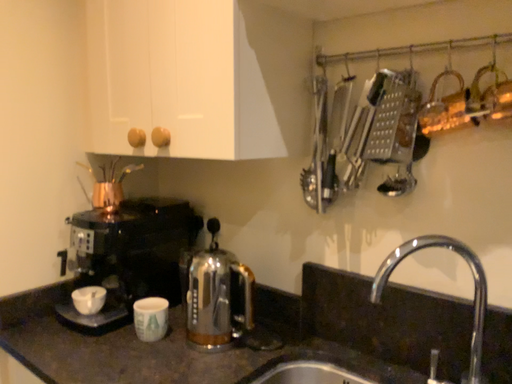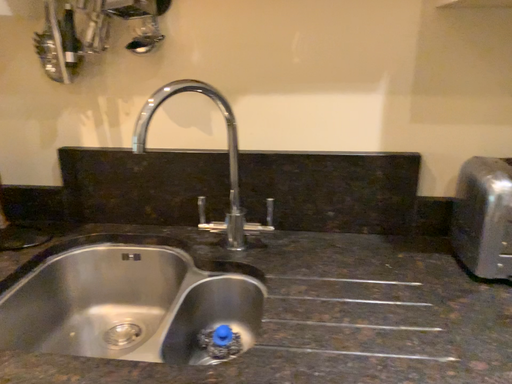
Question: Which way did the camera rotate in the video?

Choices:
 (A) rotated downward
 (B) rotated upward

Answer: (A)